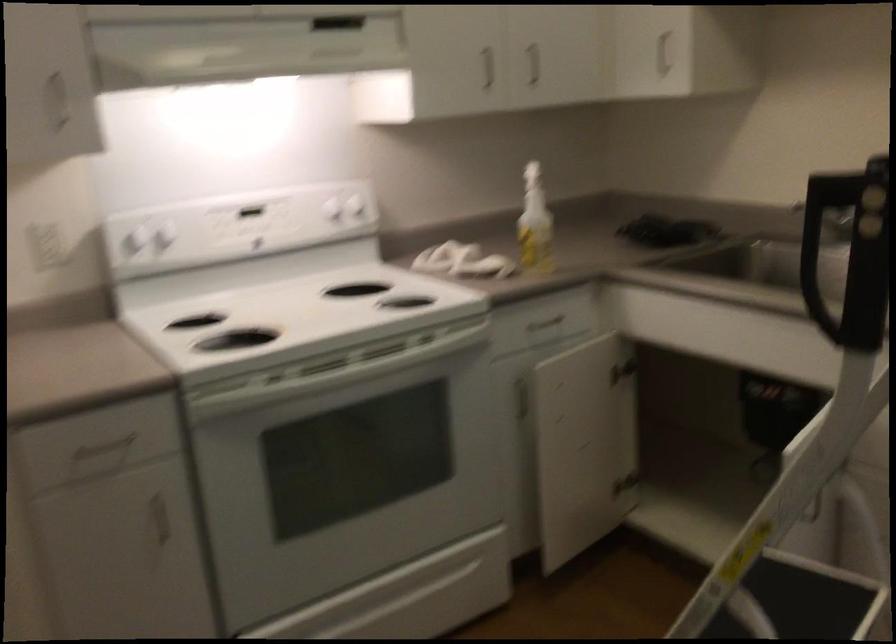
What do you see at coordinates (535, 223) in the screenshot?
I see `the yellow spray bottle` at bounding box center [535, 223].